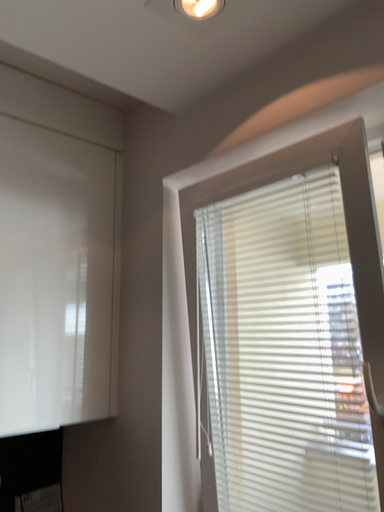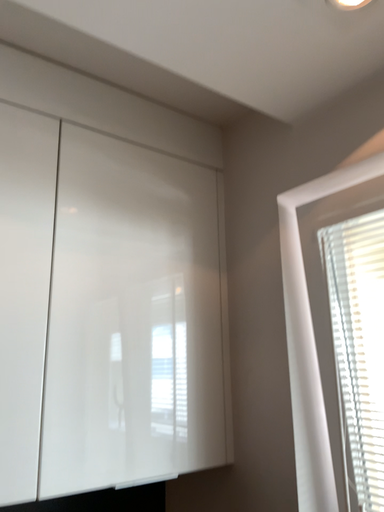
Question: Which way did the camera rotate in the video?

Choices:
 (A) rotated right
 (B) rotated left

Answer: (B)